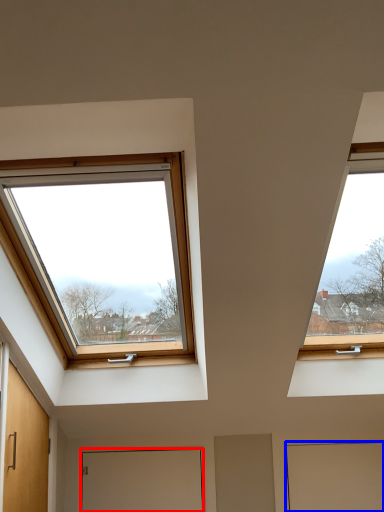
Question: Which point is closer to the camera, door (highlighted by a red box) or door (highlighted by a blue box)?

Choices:
 (A) door
 (B) door

Answer: (B)